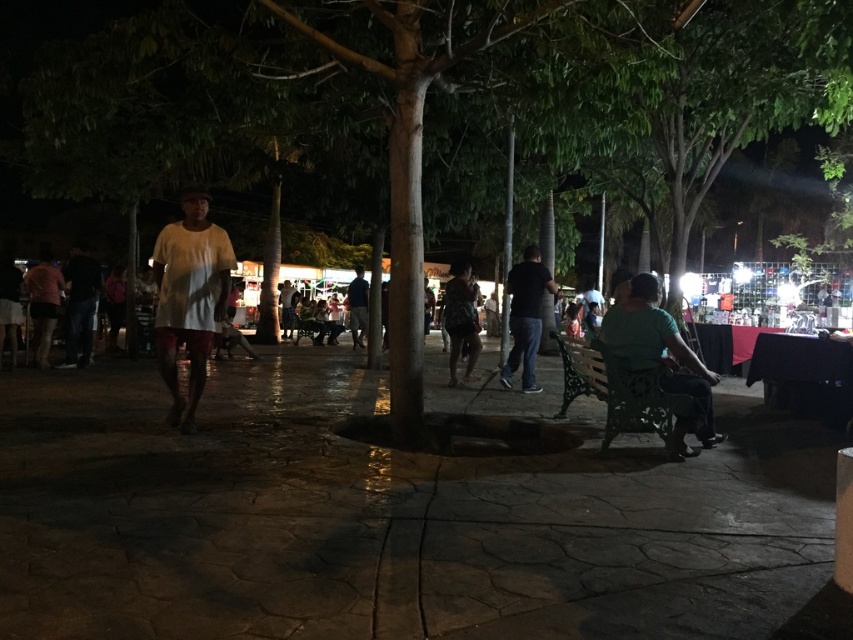
Which is below, green fabric shirt at center or dark blue jeans at center?

green fabric shirt at center

Is green fabric shirt at center bigger than dark blue jeans at center?

Indeed, green fabric shirt at center has a larger size compared to dark blue jeans at center.

Which is behind, point (660, 344) or point (537, 301)?

Point (537, 301)

Where is `green fabric shirt at center`? The width and height of the screenshot is (853, 640). green fabric shirt at center is located at coordinates (660, 358).

Which is in front, point (201, 355) or point (463, 314)?

Point (201, 355) is more forward.

Who is positioned more to the left, white matte shirt at center or matte black dress at center?

white matte shirt at center is more to the left.

Measure the distance between white matte shirt at center and camera.

white matte shirt at center is 5.04 meters from camera.

You are a GUI agent. You are given a task and a screenshot of the screen. Output one action in this format:
    pyautogui.click(x=<x>, y=<y>)
    Task: Click on the white matte shirt at center
    This screenshot has width=853, height=640.
    Given the screenshot: What is the action you would take?
    pyautogui.click(x=189, y=298)

Is point (660, 323) less distant than point (57, 278)?

Yes, it is in front of point (57, 278).

Is the position of green fabric shirt at center more distant than that of matte pink shirt at left?

No.

Between point (611, 330) and point (44, 324), which one is positioned in front?

Point (611, 330)

You are a GUI agent. You are given a task and a screenshot of the screen. Output one action in this format:
    pyautogui.click(x=<x>, y=<y>)
    Task: Click on the green fabric shirt at center
    
    Given the screenshot: What is the action you would take?
    pyautogui.click(x=660, y=358)